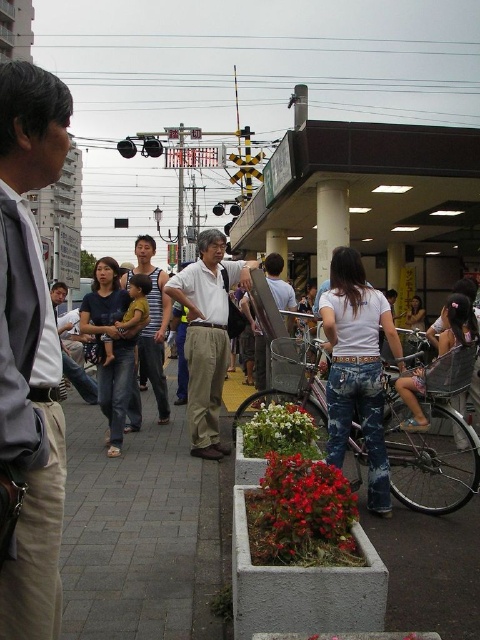
Can you confirm if metallic silver bicycle at center is shorter than matte white shirt at center?

Yes, metallic silver bicycle at center is shorter than matte white shirt at center.

Does metallic silver bicycle at center have a greater height compared to matte white shirt at center?

Incorrect, metallic silver bicycle at center's height is not larger of matte white shirt at center's.

What do you see at coordinates (432, 442) in the screenshot?
I see `metallic silver bicycle at center` at bounding box center [432, 442].

Where is `metallic silver bicycle at center`? This screenshot has height=640, width=480. metallic silver bicycle at center is located at coordinates (432, 442).

Is the position of gray concrete pavement at center less distant than that of matte khaki pants at center?

Yes, it is in front of matte khaki pants at center.

Is point (132, 602) behind point (216, 266)?

No, (132, 602) is in front of (216, 266).

Who is more distant from viewer, (182, 460) or (191, 362)?

Positioned behind is point (191, 362).

Locate an element on the screen. The height and width of the screenshot is (640, 480). gray concrete pavement at center is located at coordinates (139, 532).

Which of these two, gray concrete pavement at center or metallic silver bicycle at center, stands shorter?

gray concrete pavement at center

Is gray concrete pavement at center closer to camera compared to metallic silver bicycle at center?

No, it is behind metallic silver bicycle at center.

Who is more forward, (x=75, y=490) or (x=468, y=445)?

Point (x=75, y=490) is in front.

At what (x,y) coordinates should I click in order to perform the action: click on gray concrete pavement at center. Please return your answer as a coordinate pair (x, y). Looking at the image, I should click on (139, 532).